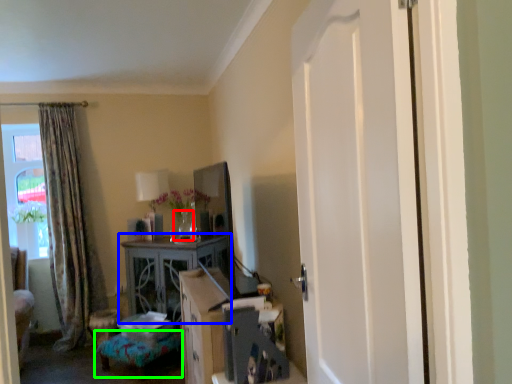
Question: Based on their relative distances, which object is nearer to vase (highlighted by a red box)? Choose from table (highlighted by a blue box) and furniture (highlighted by a green box).

Choices:
 (A) table
 (B) furniture

Answer: (A)